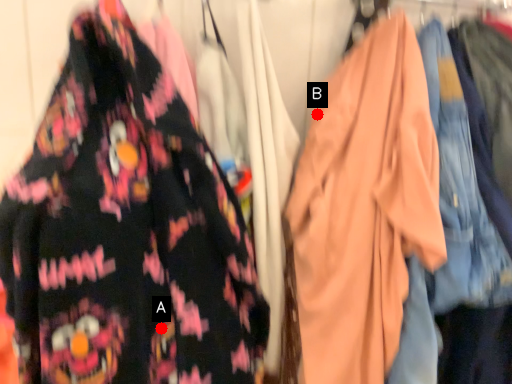
Question: Two points are circled on the image, labeled by A and B beside each circle. Which point is farther to the camera?

Choices:
 (A) A is further
 (B) B is further

Answer: (B)